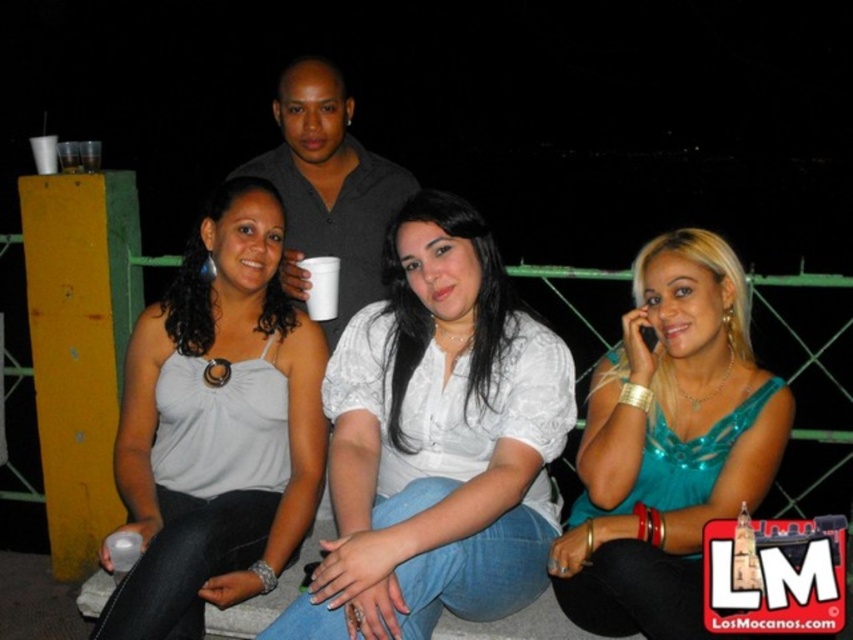
Question: Can you confirm if matte gray tank top at center is positioned above dark gray shirt at center?

Choices:
 (A) yes
 (B) no

Answer: (B)

Question: Which object is closer to the camera taking this photo?

Choices:
 (A) teal satin blouse at center
 (B) white lace blouse at center

Answer: (B)

Question: In this image, where is white lace blouse at center located relative to matte gray tank top at center?

Choices:
 (A) below
 (B) above

Answer: (B)

Question: From the image, what is the correct spatial relationship of white lace blouse at center in relation to teal satin blouse at center?

Choices:
 (A) right
 (B) left

Answer: (B)

Question: Among these objects, which one is farthest from the camera?

Choices:
 (A) matte gray tank top at center
 (B) teal satin blouse at center

Answer: (A)

Question: Which object appears farthest from the camera in this image?

Choices:
 (A) teal satin blouse at center
 (B) white lace blouse at center
 (C) matte gray tank top at center

Answer: (C)